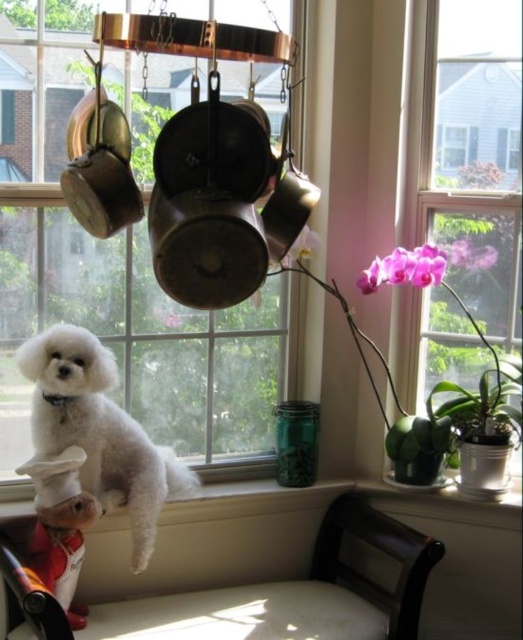
Does clear glass window at center have a larger size compared to white fluffy dog at center?

Correct, clear glass window at center is larger in size than white fluffy dog at center.

Is clear glass window at center smaller than white fluffy dog at center?

No, clear glass window at center is not smaller than white fluffy dog at center.

Where is `clear glass window at center`? The image size is (523, 640). clear glass window at center is located at coordinates (174, 252).

Who is positioned more to the right, pink orchid at upper right or white fabric chair at lower center?

Positioned to the right is pink orchid at upper right.

Is pink orchid at upper right to the right of white fabric chair at lower center from the viewer's perspective?

Correct, you'll find pink orchid at upper right to the right of white fabric chair at lower center.

Image resolution: width=523 pixels, height=640 pixels. In order to click on pink orchid at upper right in this screenshot , I will do `click(465, 150)`.

This screenshot has width=523, height=640. In order to click on pink orchid at upper right in this screenshot , I will do `click(465, 150)`.

Who is positioned more to the left, white fabric chair at lower center or matte red chef hat at lower left?

matte red chef hat at lower left

Does white fabric chair at lower center appear on the right side of matte red chef hat at lower left?

Indeed, white fabric chair at lower center is positioned on the right side of matte red chef hat at lower left.

The image size is (523, 640). Describe the element at coordinates (295, 593) in the screenshot. I see `white fabric chair at lower center` at that location.

Identify the location of white fabric chair at lower center. (295, 593).